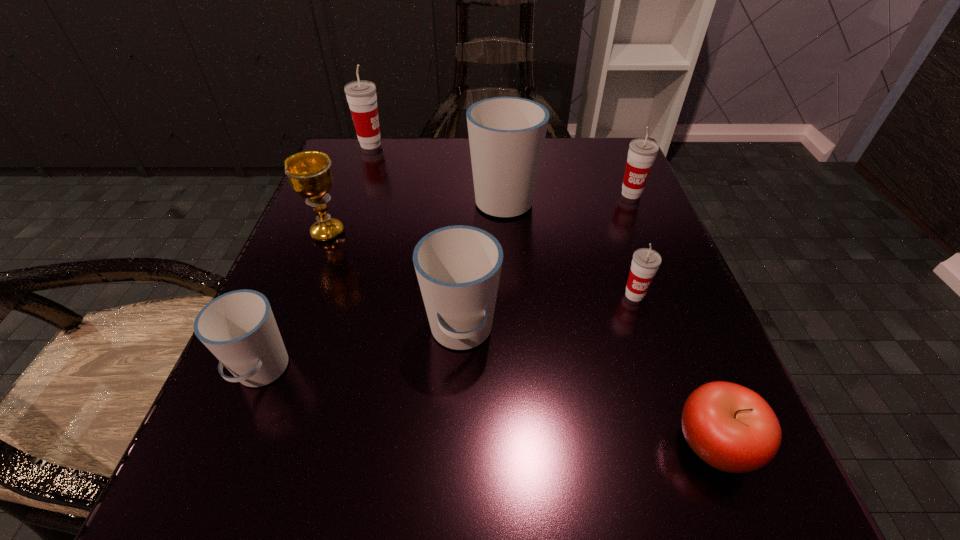
Where is `the farthest cup`? the farthest cup is located at coordinates (361, 96).

At what (x,y) coordinates should I click in order to perform the action: click on the biggest red cup. Please return your answer as a coordinate pair (x, y). Looking at the image, I should click on (361, 96).

Image resolution: width=960 pixels, height=540 pixels. I want to click on the biggest white cup, so click(x=506, y=134).

The image size is (960, 540). I want to click on chalice, so click(309, 172).

Locate an element on the screen. The width and height of the screenshot is (960, 540). the rightmost red cup is located at coordinates (642, 152).

Where is `the second nearest red cup`? Image resolution: width=960 pixels, height=540 pixels. the second nearest red cup is located at coordinates (642, 152).

Find the location of a particular element. The height and width of the screenshot is (540, 960). the second biggest white cup is located at coordinates (458, 268).

This screenshot has height=540, width=960. Find the location of `the smallest white cup`. the smallest white cup is located at coordinates (239, 328).

Find the location of a particular element. This screenshot has height=540, width=960. the second red cup from left to right is located at coordinates (645, 263).

The height and width of the screenshot is (540, 960). In order to click on the nearest red cup in this screenshot , I will do `click(645, 263)`.